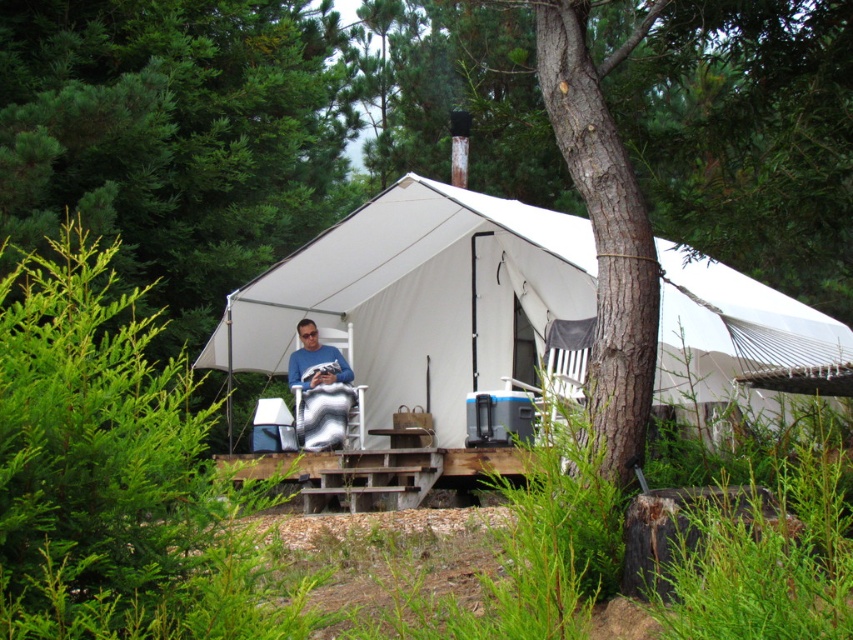
Does white canvas tent at center have a lesser height compared to matte blue shirt at center?

In fact, white canvas tent at center may be taller than matte blue shirt at center.

Between white canvas tent at center and matte blue shirt at center, which one appears on the left side from the viewer's perspective?

matte blue shirt at center is more to the left.

What do you see at coordinates (419, 298) in the screenshot? I see `white canvas tent at center` at bounding box center [419, 298].

Identify the location of white canvas tent at center. (419, 298).